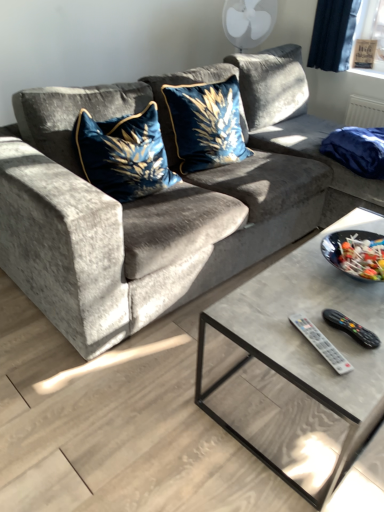
Question: Considering the positions of velvet gray couch at center and velvet blue cushion at center, the 1th throw pillow positioned from the right, in the image, is velvet gray couch at center taller or shorter than velvet blue cushion at center, the 1th throw pillow positioned from the right,?

Choices:
 (A) tall
 (B) short

Answer: (A)

Question: From the image's perspective, is velvet gray couch at center located above or below velvet blue cushion at center, the 1th throw pillow positioned from the right?

Choices:
 (A) below
 (B) above

Answer: (A)

Question: Which object is the closest to the velvet gray couch at center?

Choices:
 (A) velvet blue pillow at upper right
 (B) velvet blue pillow at center, the first throw pillow from the left
 (C) velvet blue cushion at center, arranged as the second throw pillow when viewed from the left
 (D) white plastic remote at lower right, arranged as the first remote when viewed from the left
 (E) black plastic remote at lower right, which is counted as the first remote, starting from the right

Answer: (B)

Question: Considering the real-world distances, which object is closest to the velvet blue pillow at center, which is the 2th throw pillow from right to left?

Choices:
 (A) velvet gray couch at center
 (B) velvet blue cushion at center, the 1th throw pillow positioned from the right
 (C) white plastic remote at lower right, arranged as the first remote when viewed from the left
 (D) black plastic remote at lower right, which is counted as the first remote, starting from the right
 (E) velvet blue pillow at upper right

Answer: (A)